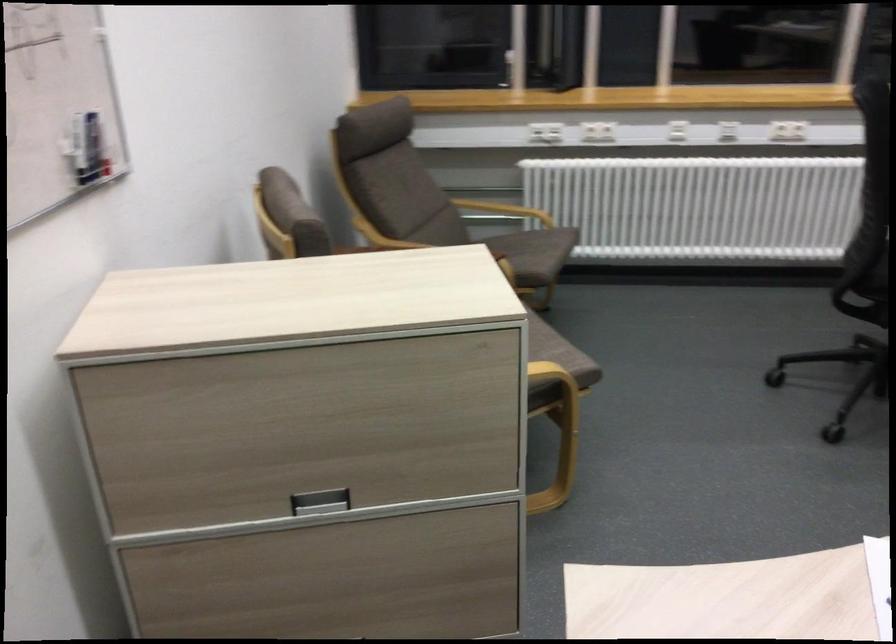
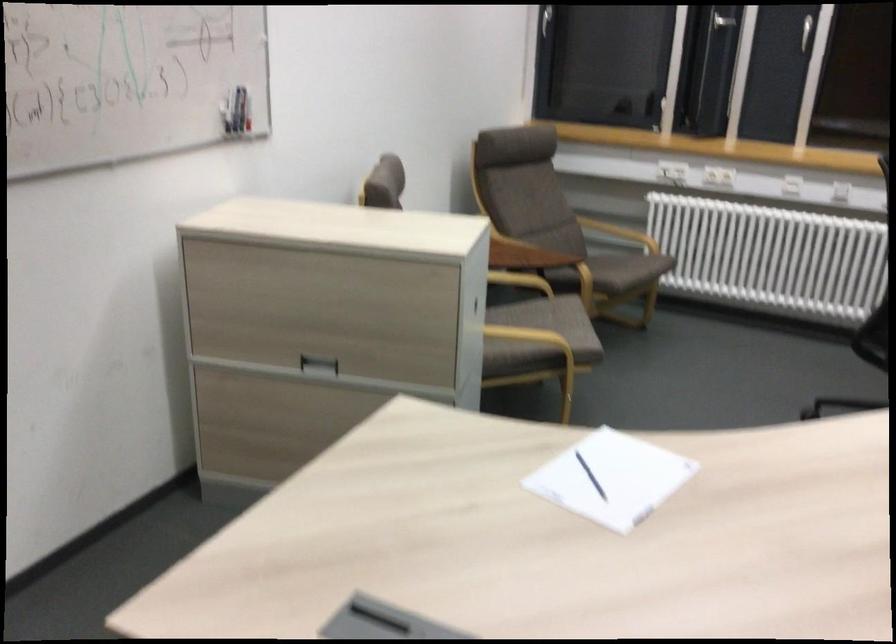
In the second image, find the point that corresponds to (x=502, y=211) in the first image.

(619, 232)